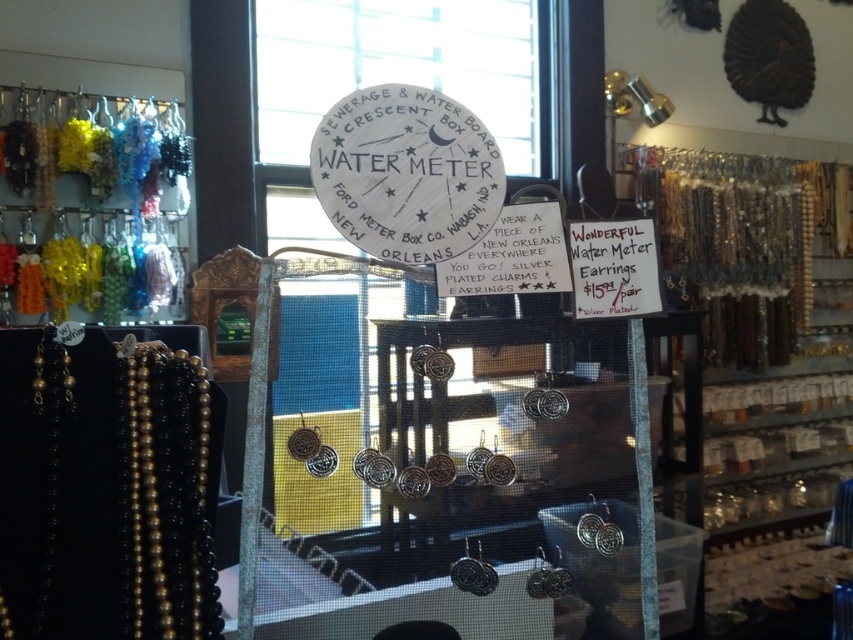
Question: In this image, where is black beaded necklace at left located relative to multicolored beads at left?

Choices:
 (A) above
 (B) below

Answer: (B)

Question: Which point is closer to the camera?

Choices:
 (A) black beaded necklace at left
 (B) multicolored beads at left

Answer: (A)

Question: Is black beaded necklace at left to the right of multicolored beads at left from the viewer's perspective?

Choices:
 (A) yes
 (B) no

Answer: (A)

Question: Is black beaded necklace at left wider than multicolored beads at left?

Choices:
 (A) no
 (B) yes

Answer: (A)